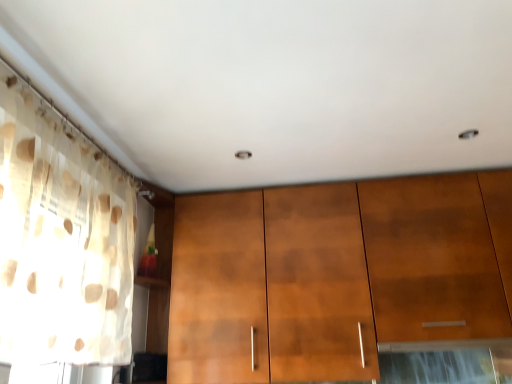
The height and width of the screenshot is (384, 512). Describe the element at coordinates (335, 274) in the screenshot. I see `wooden cabinet at center` at that location.

I want to click on wooden cabinet at center, so click(335, 274).

Where is `wooden cabinet at center`? This screenshot has width=512, height=384. wooden cabinet at center is located at coordinates (335, 274).